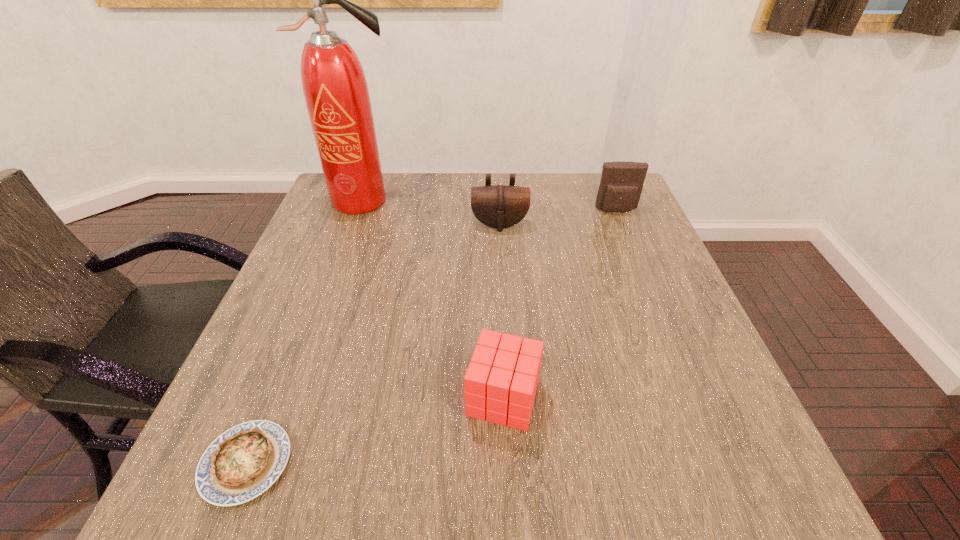
Identify the location of free area in between the fire extinguisher and the cube. (433, 299).

Identify the location of free area in between the nearer pouch and the tallest object. (431, 212).

Where is `free space between the fire extinguisher and the shortest object`? free space between the fire extinguisher and the shortest object is located at coordinates (304, 332).

Image resolution: width=960 pixels, height=540 pixels. In order to click on unoccupied area between the quiche and the rightmost object in this screenshot , I will do `click(431, 337)`.

The image size is (960, 540). I want to click on vacant space that's between the farther pouch and the left pouch, so click(558, 217).

Select which object appears as the fourth closest to the quiche. Please provide its 2D coordinates. Your answer should be formatted as a tuple, i.e. [(x, y)], where the tuple contains the x and y coordinates of a point satisfying the conditions above.

[(621, 184)]

Identify which object is the second nearest to the left pouch. Please provide its 2D coordinates. Your answer should be formatted as a tuple, i.e. [(x, y)], where the tuple contains the x and y coordinates of a point satisfying the conditions above.

[(336, 93)]